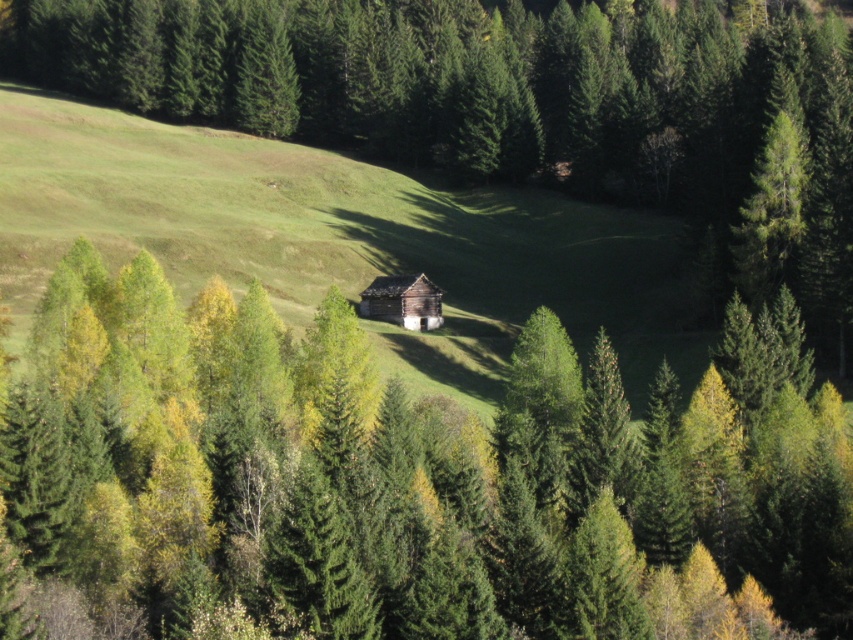
Question: Is green matte tree at center smaller than wooden log cabin at center?

Choices:
 (A) no
 (B) yes

Answer: (A)

Question: Can you confirm if green matte tree at center is positioned to the right of wooden log cabin at center?

Choices:
 (A) yes
 (B) no

Answer: (B)

Question: Is green matte tree at center smaller than wooden log cabin at center?

Choices:
 (A) no
 (B) yes

Answer: (A)

Question: Which point is closer to the camera taking this photo?

Choices:
 (A) (410, 296)
 (B) (734, 564)

Answer: (B)

Question: Which of the following is the closest to the observer?

Choices:
 (A) (393, 291)
 (B) (308, 349)

Answer: (B)